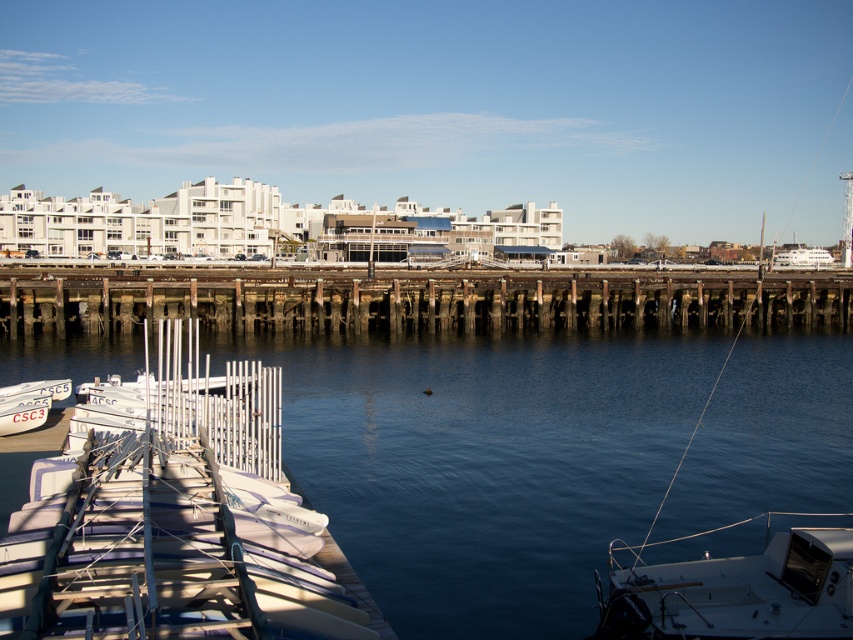
You are standing at the center of the image and want to walk to the white matte dock at lower left. Which direction should you move relative to your current position?

You should move towards the lower left direction to reach the white matte dock at lower left.

You are a photographer standing on the white matte dock at lower left, and you want to take a photo of the white matte boat at lower right. Considering their heights, will the dock block your view of the boat?

The white matte dock at lower left is taller than the white matte boat at lower right, so it may block your view of the boat depending on your position and angle.